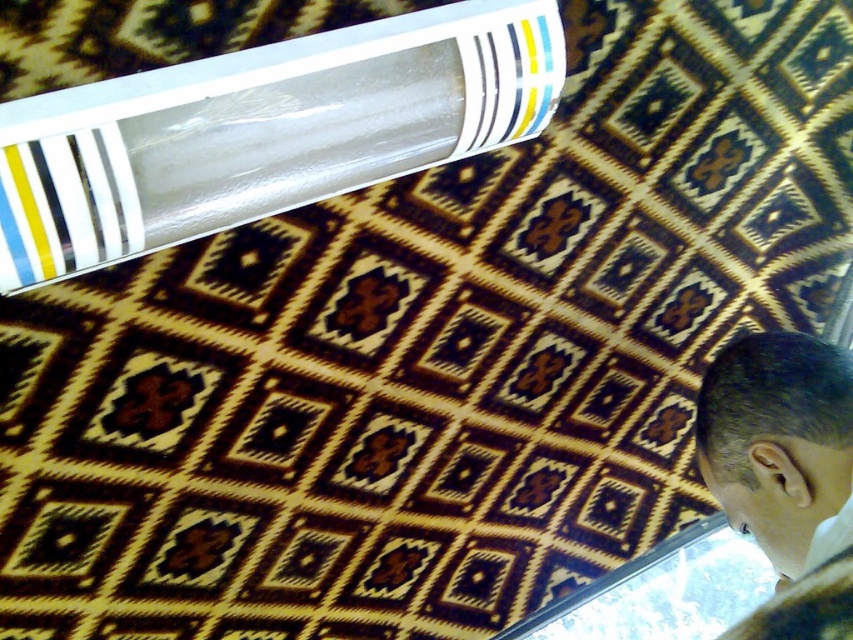
You are an interior designer examining the ceiling design. You notice the transparent plastic tube at upper left. Based on its position, can you determine if it is closer to the upper edge or the lower edge of the ceiling?

The transparent plastic tube at upper left is located at point coordinates where the y value is 0.311. Since the coordinate system likely places 0 at the bottom and 1 at the top, a y value of 0.311 means it is closer to the lower edge than the upper edge of the ceiling.

You are standing under the patterned ceiling and see two points marked on it. Which point is closer to you, point (462,104) or point (747,506)?

Point (462,104) is closer to the viewer than point (747,506).